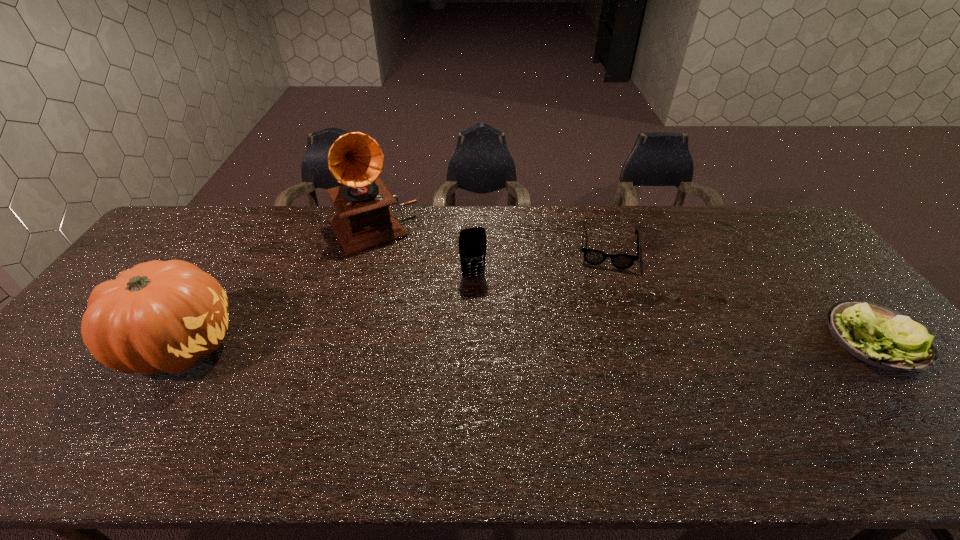
What are the coordinates of `object identified as the fourth closest to the shortest object` in the screenshot? It's located at (157, 316).

Identify which object is the nearest to the third nearest object. Please provide its 2D coordinates. Your answer should be formatted as a tuple, i.e. [(x, y)], where the tuple contains the x and y coordinates of a point satisfying the conditions above.

[(364, 221)]

Locate an element on the screen. This screenshot has height=540, width=960. vacant area in the image that satisfies the following two spatial constraints: 1. on the back side of the spectacles; 2. on the left side of the cellular telephone is located at coordinates (473, 249).

Image resolution: width=960 pixels, height=540 pixels. I want to click on free spot that satisfies the following two spatial constraints: 1. on the front side of the second object from left to right; 2. on the left side of the rightmost object, so click(x=339, y=339).